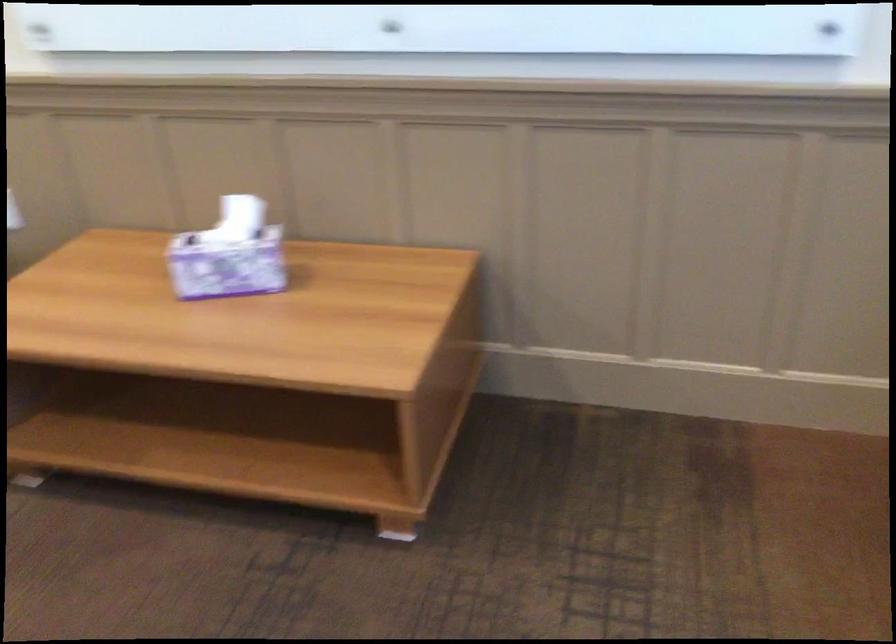
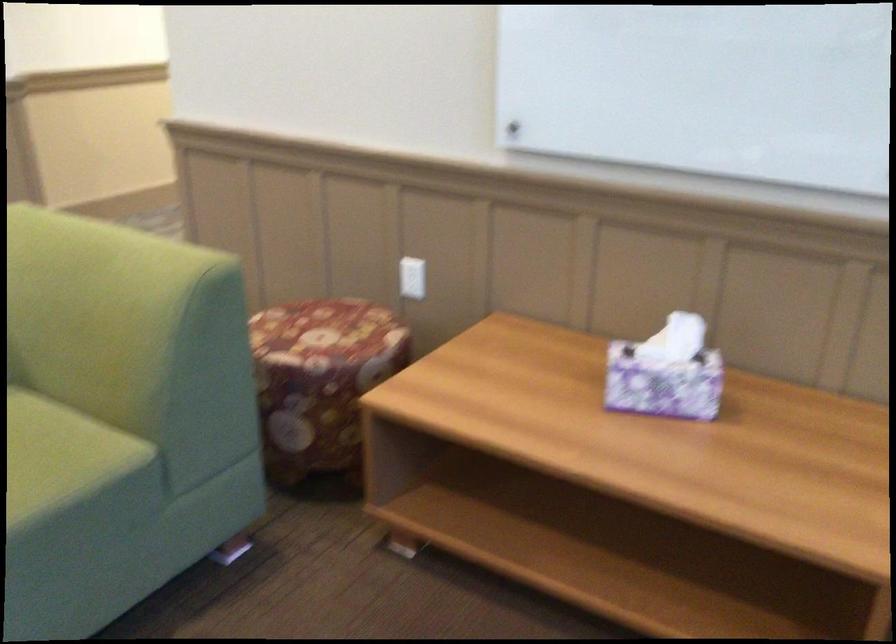
Question: The images are taken continuously from a first-person perspective. In which direction are you moving?

Choices:
 (A) Left
 (B) Right
 (C) Forward
 (D) Backward

Answer: (A)